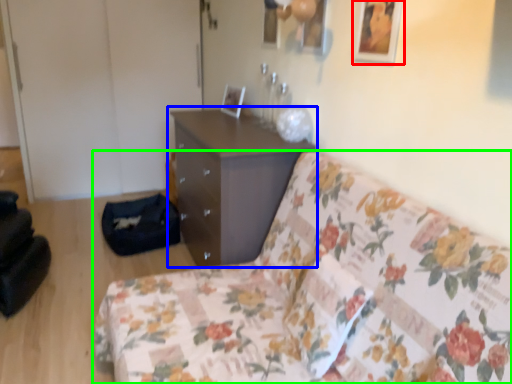
Question: Estimate the real-world distances between objects in this image. Which object is farther from picture frame (highlighted by a red box), chest of drawers (highlighted by a blue box) or studio couch (highlighted by a green box)?

Choices:
 (A) chest of drawers
 (B) studio couch

Answer: (A)